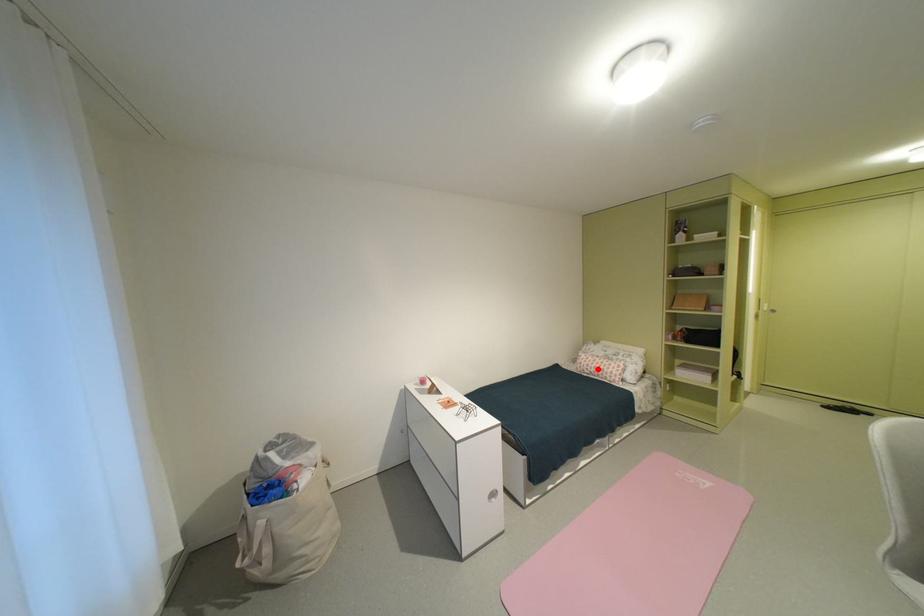
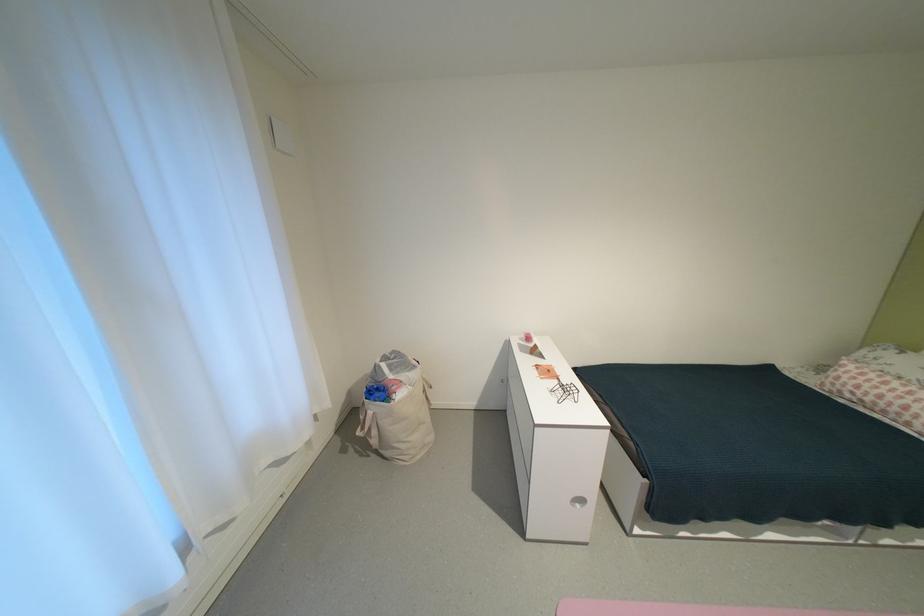
Question: A red point is marked in image1. In image2, is the corresponding 3D point closer to the camera or farther? Reply with the corresponding letter.

Choices:
 (A) The corresponding 3D point is closer.
 (B) The corresponding 3D point is farther.

Answer: (B)